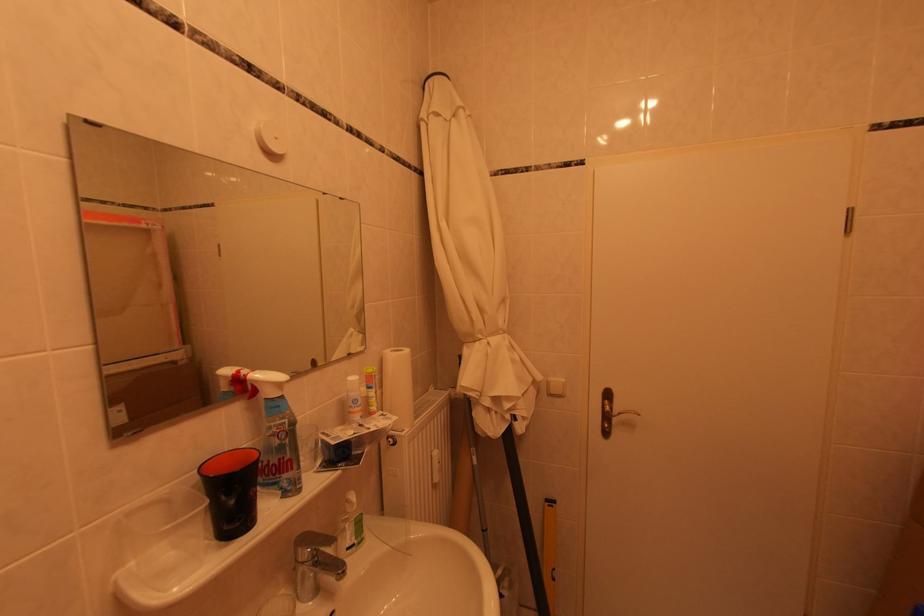
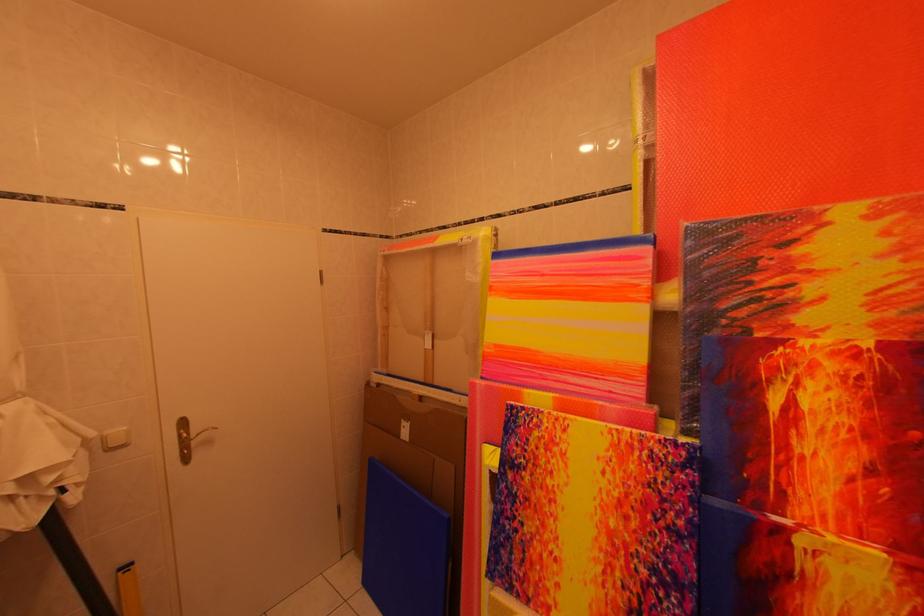
Question: Based on the continuous images, in which direction is the camera rotating? Reply with the corresponding letter.

Choices:
 (A) Left
 (B) Right
 (C) Up
 (D) Down

Answer: (B)